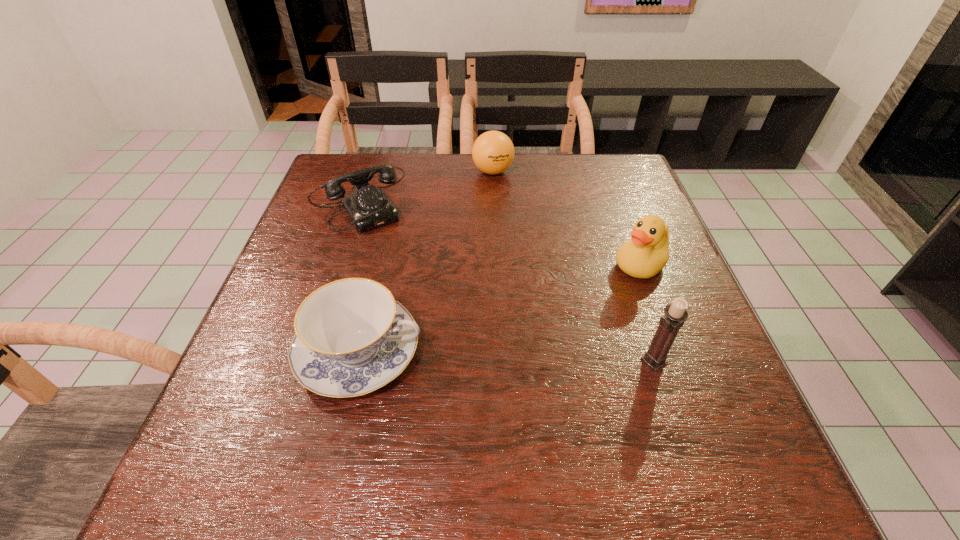
This screenshot has height=540, width=960. I want to click on chinaware, so click(351, 338).

Where is `candle holder`? The image size is (960, 540). candle holder is located at coordinates (675, 315).

Identify the location of the third object from left to right. (493, 152).

The height and width of the screenshot is (540, 960). Identify the location of telephone. (368, 207).

Image resolution: width=960 pixels, height=540 pixels. Find the location of `duck`. duck is located at coordinates (646, 254).

At what (x,y) coordinates should I click in order to perform the action: click on the second tallest object. Please return your answer as a coordinate pair (x, y). This screenshot has height=540, width=960. Looking at the image, I should click on (646, 254).

Where is `blank space located 0.140m with the handle on the side of the chinaware`? The width and height of the screenshot is (960, 540). blank space located 0.140m with the handle on the side of the chinaware is located at coordinates [497, 352].

Locate an element on the screen. Image resolution: width=960 pixels, height=540 pixels. vacant space located on the back of the candle holder is located at coordinates (640, 321).

Image resolution: width=960 pixels, height=540 pixels. Identify the location of vacant space located 0.350m on the side with brand of the ping-pong ball. (485, 269).

What are the coordinates of `free point located on the side with brand of the ping-pong ball` in the screenshot? It's located at (485, 266).